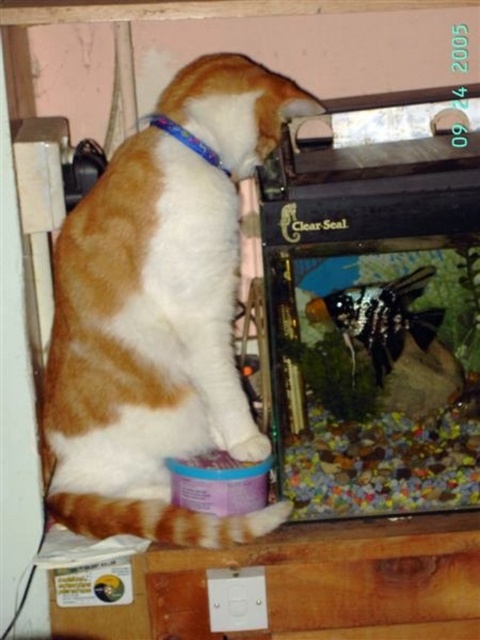
You are a photographer trying to capture a clear shot of the black glossy fish at center. However, the orange and white fur cat at center is blocking your view. Can you move the cat to get a better angle? Explain why or why not based on their positions.

The orange and white fur cat at center is closer to the viewer than the black glossy fish at center. Moving the cat would allow the photographer to see the fish clearly, as the cat is currently in front of the fish.